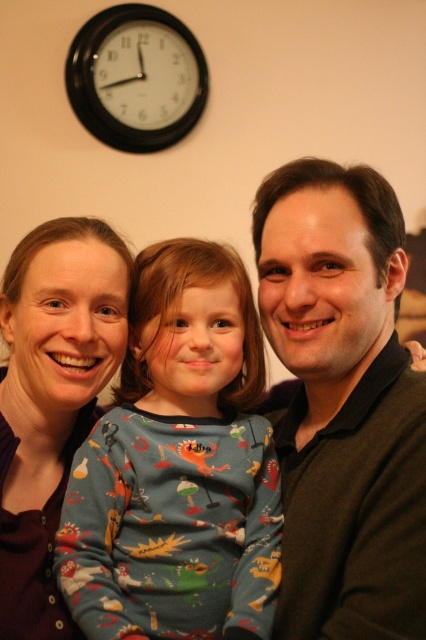
Question: Which object is positioned farthest from the black plastic clock at upper left?

Choices:
 (A) printed cotton pajamas at center
 (B) matte brown hair at center
 (C) dark brown sweater at center

Answer: (A)

Question: Is matte brown hair at center in front of black plastic clock at upper left?

Choices:
 (A) no
 (B) yes

Answer: (B)

Question: Which is farther from the printed cotton pajamas at center?

Choices:
 (A) dark brown sweater at center
 (B) black plastic clock at upper left
 (C) matte brown hair at center

Answer: (B)

Question: Which point is closer to the camera?

Choices:
 (A) printed cotton pajamas at center
 (B) black plastic clock at upper left
 (C) matte brown hair at center

Answer: (A)

Question: From the image, what is the correct spatial relationship of matte brown hair at center in relation to black plastic clock at upper left?

Choices:
 (A) left
 (B) right

Answer: (B)

Question: Is printed cotton pajamas at center bigger than dark brown sweater at center?

Choices:
 (A) no
 (B) yes

Answer: (A)